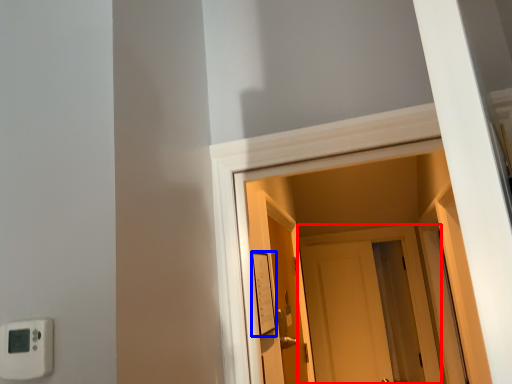
Question: Among these objects, which one is farthest to the camera, door (highlighted by a red box) or light switch (highlighted by a blue box)?

Choices:
 (A) door
 (B) light switch

Answer: (A)